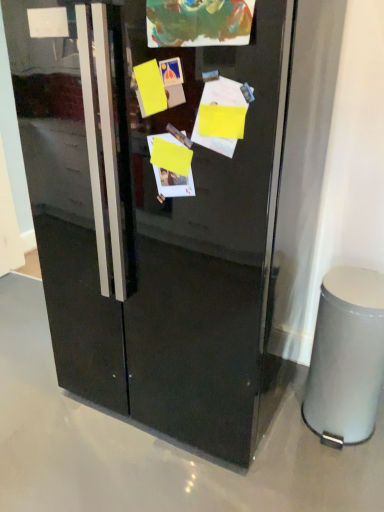
Question: Is glossy black refrigerator at center wider than silver metallic trash bin at lower right?

Choices:
 (A) yes
 (B) no

Answer: (A)

Question: Does glossy black refrigerator at center appear on the right side of silver metallic trash bin at lower right?

Choices:
 (A) yes
 (B) no

Answer: (B)

Question: Could you tell me if glossy black refrigerator at center is turned towards silver metallic trash bin at lower right?

Choices:
 (A) yes
 (B) no

Answer: (B)

Question: Is the surface of glossy black refrigerator at center in direct contact with silver metallic trash bin at lower right?

Choices:
 (A) yes
 (B) no

Answer: (B)

Question: From the image's perspective, is glossy black refrigerator at center above silver metallic trash bin at lower right?

Choices:
 (A) no
 (B) yes

Answer: (B)

Question: Can we say glossy black refrigerator at center lies outside silver metallic trash bin at lower right?

Choices:
 (A) yes
 (B) no

Answer: (A)

Question: From the image's perspective, is silver metallic trash bin at lower right over glossy black refrigerator at center?

Choices:
 (A) yes
 (B) no

Answer: (B)

Question: Does silver metallic trash bin at lower right have a larger size compared to glossy black refrigerator at center?

Choices:
 (A) yes
 (B) no

Answer: (B)

Question: Is silver metallic trash bin at lower right positioned far away from glossy black refrigerator at center?

Choices:
 (A) yes
 (B) no

Answer: (B)

Question: Considering the relative sizes of silver metallic trash bin at lower right and glossy black refrigerator at center in the image provided, is silver metallic trash bin at lower right smaller than glossy black refrigerator at center?

Choices:
 (A) no
 (B) yes

Answer: (B)

Question: From the image's perspective, is silver metallic trash bin at lower right below glossy black refrigerator at center?

Choices:
 (A) yes
 (B) no

Answer: (A)

Question: Is silver metallic trash bin at lower right aimed at glossy black refrigerator at center?

Choices:
 (A) yes
 (B) no

Answer: (B)

Question: Is silver metallic trash bin at lower right taller or shorter than glossy black refrigerator at center?

Choices:
 (A) short
 (B) tall

Answer: (A)